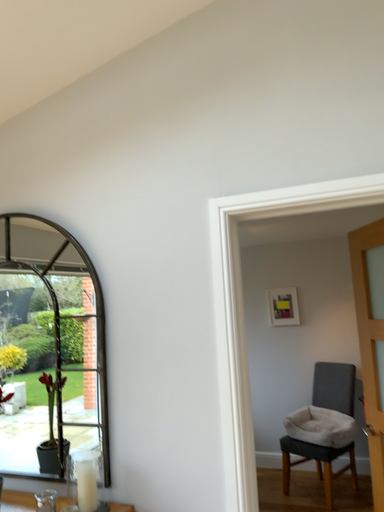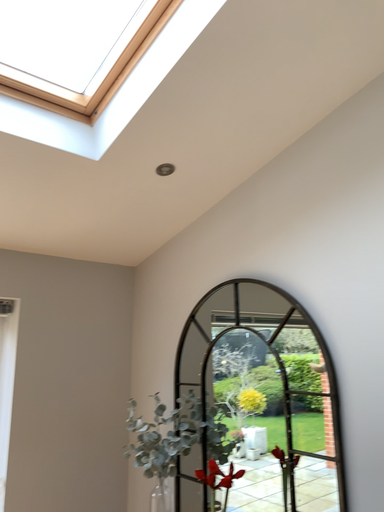
Question: How did the camera likely rotate when shooting the video?

Choices:
 (A) rotated left
 (B) rotated right

Answer: (A)